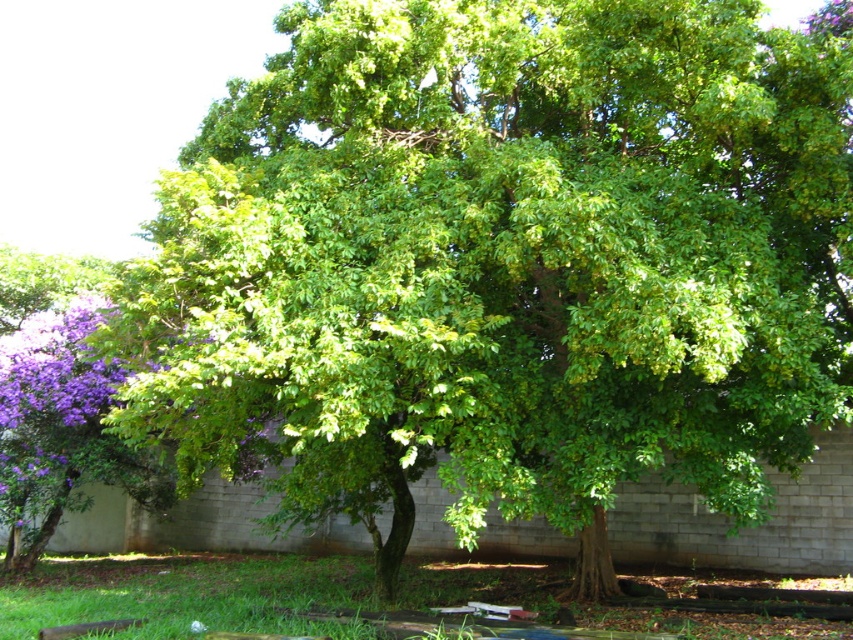
You are standing at the center of the image and want to walk towards the green grass at lower center. Which direction should you move?

The green grass at lower center is located at point (189, 593), so you should move towards the lower center direction to reach it.

Based on the photo, you are standing in a garden and want to place a small statue between the green grass at lower center and the purple matte flower at left. Which object should the statue be closer to if it needs to be near the larger one?

The statue should be closer to the green grass at lower center because it is larger than the purple matte flower at left.

You are standing at the point marked by the coordinates in the image. Looking around, you see a lush green tree with a curved trunk and a gray brick wall in the background. There is also a tree with purple flowers to the left. Which direction should you face to see the green grass at lower center located at point (x=189, y=593)?

The green grass at lower center is located at point (x=189, y=593), so you should face downward or towards the lower center of the image to see it.